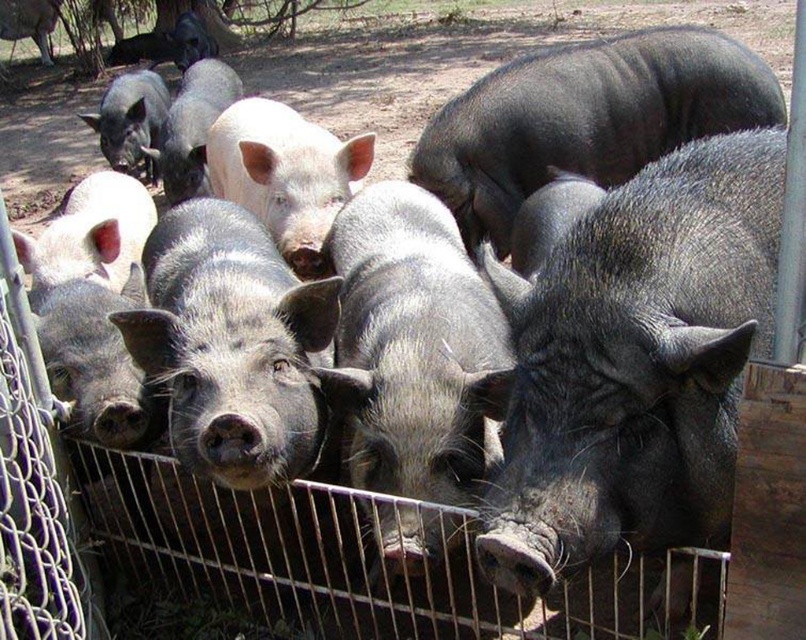
You are a farmer standing at the edge of the pigpen. You need to feed the gray textured pig at center and the shiny black pig at center. If your feeding bucket can reach up to 5 feet, will you be able to feed both pigs without moving closer?

The gray textured pig at center is 5.59 feet away from the shiny black pig at center. Since the distance between them is greater than 5 feet, the feeding bucket cannot reach both pigs simultaneously. You will need to move closer to feed each one individually.

You are a farmer checking the pigs in the farm. You notice the gray textured pig at center and the shiny black pig at center. Which pig is bigger in size?

The gray textured pig at center is larger in size compared to the shiny black pig at center.

You are standing at the origin point in the image and want to reach the point at the lower right corner. Which point should you pass through first, point (733, 456) or point (368, 506)?

You should pass through point (733, 456) first because it is in front of point (368, 506).